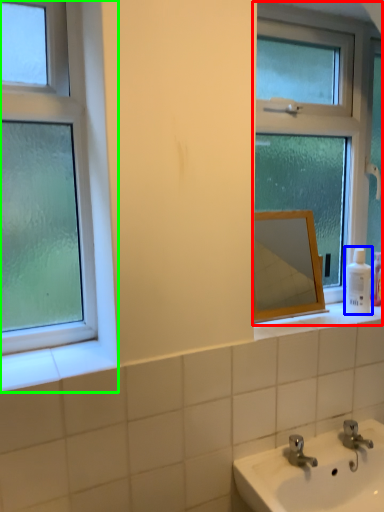
Question: Which is farther away from window (highlighted by a red box)? toiletry (highlighted by a blue box) or window (highlighted by a green box)?

Choices:
 (A) toiletry
 (B) window

Answer: (B)